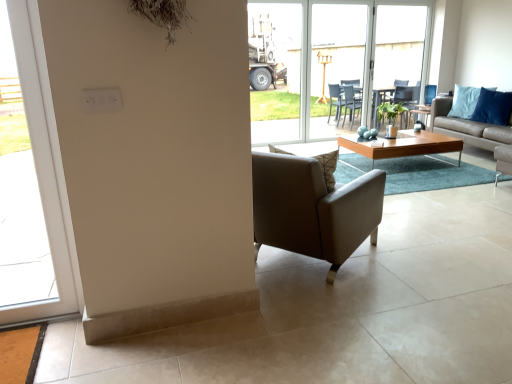
Question: Is leather at center positioned far away from transparent glass screen door at center, the 2th screen door from the left?

Choices:
 (A) no
 (B) yes

Answer: (B)

Question: Could you tell me if leather at center is turned towards transparent glass screen door at center, the 2th screen door from the left?

Choices:
 (A) yes
 (B) no

Answer: (A)

Question: Does leather at center have a lesser height compared to transparent glass screen door at center, the 2th screen door from the left?

Choices:
 (A) yes
 (B) no

Answer: (A)

Question: Does leather at center appear on the right side of transparent glass screen door at center, marked as the first screen door in a right-to-left arrangement?

Choices:
 (A) yes
 (B) no

Answer: (B)

Question: Is leather at center with transparent glass screen door at center, the 2th screen door from the left?

Choices:
 (A) no
 (B) yes

Answer: (A)

Question: From the image's perspective, is green matte plant at center positioned above or below blue fabric pillow at upper right?

Choices:
 (A) above
 (B) below

Answer: (B)

Question: Is green matte plant at center to the left or to the right of blue fabric pillow at upper right in the image?

Choices:
 (A) right
 (B) left

Answer: (B)

Question: From their relative heights in the image, would you say green matte plant at center is taller or shorter than blue fabric pillow at upper right?

Choices:
 (A) tall
 (B) short

Answer: (B)

Question: From a real-world perspective, relative to blue fabric pillow at upper right, is green matte plant at center vertically above or below?

Choices:
 (A) below
 (B) above

Answer: (A)

Question: Is light brown leather couch at center right bigger or smaller than transparent plastic screen door at center, arranged as the first screen door when viewed from the left?

Choices:
 (A) big
 (B) small

Answer: (A)

Question: Is light brown leather couch at center right situated inside transparent plastic screen door at center, arranged as the first screen door when viewed from the left, or outside?

Choices:
 (A) inside
 (B) outside

Answer: (B)

Question: From the image's perspective, is light brown leather couch at center right above or below transparent plastic screen door at center, which is the second screen door in right-to-left order?

Choices:
 (A) above
 (B) below

Answer: (B)

Question: In terms of width, does light brown leather couch at center right look wider or thinner when compared to transparent plastic screen door at center, arranged as the first screen door when viewed from the left?

Choices:
 (A) wide
 (B) thin

Answer: (A)

Question: From a real-world perspective, relative to blue fabric pillow at upper right, is transparent glass door at center, which ranks as the 1th window in top-to-bottom order, vertically above or below?

Choices:
 (A) below
 (B) above

Answer: (B)

Question: Is transparent glass door at center, the second window positioned from the front, to the left or to the right of blue fabric pillow at upper right in the image?

Choices:
 (A) right
 (B) left

Answer: (B)